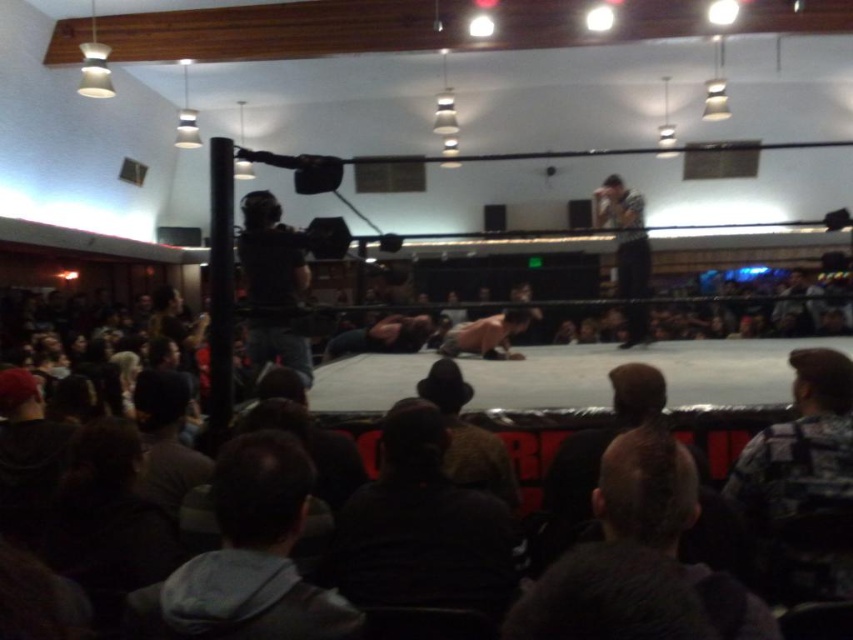
Question: Can you confirm if dark gray hoodie at lower left is smaller than striped shirt at upper right?

Choices:
 (A) no
 (B) yes

Answer: (B)

Question: Is dark brown hair at center to the left of striped shirt at upper right from the viewer's perspective?

Choices:
 (A) no
 (B) yes

Answer: (B)

Question: Is dark gray hoodie at lower left smaller than dark brown leather jacket at center?

Choices:
 (A) no
 (B) yes

Answer: (B)

Question: Which point is farther to the camera?

Choices:
 (A) (270, 616)
 (B) (505, 451)
 (C) (840, 563)

Answer: (B)

Question: Estimate the real-world distances between objects in this image. Which object is closer to the dark brown leather jacket at center?

Choices:
 (A) smooth skin man at center
 (B) skinny man at center
 (C) dark brown hair at center

Answer: (C)

Question: Which point appears closest to the camera in this image?

Choices:
 (A) (x=666, y=625)
 (B) (x=625, y=240)
 (C) (x=764, y=499)
 (D) (x=456, y=525)

Answer: (A)